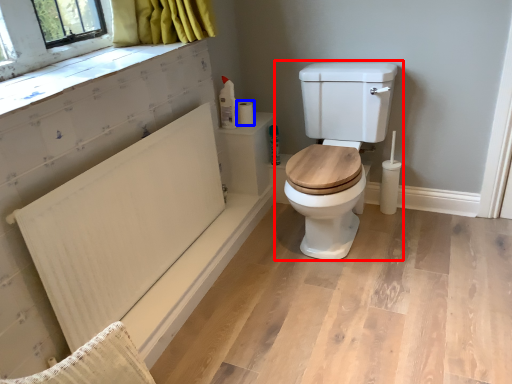
Question: Which point is closer to the camera, toilet (highlighted by a red box) or toilet paper (highlighted by a blue box)?

Choices:
 (A) toilet
 (B) toilet paper

Answer: (A)